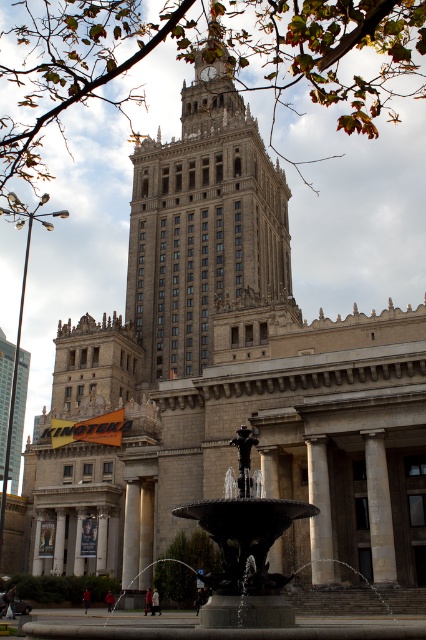
You are standing in front of the grand building with the fountain. You notice two points marked on the image. Which point, point 1 at position (258, 627) or point 2 at position (319, 493), is closer to you?

Point 1 at position (258, 627) is closer to you than point 2 at position (319, 493).

From the picture: You are standing in front of the building and want to take a photo of both the bronze metallic fountain at center and the slate gray stone column at center. Which object should you focus on first to ensure both are in the frame?

You should focus on the bronze metallic fountain at center first because it is closer to you than the slate gray stone column at center, so by focusing on it, the column will also be in focus if they are within the same depth of field.

You are an architect planning to install a new sculpture in the plaza in front of the building. The sculpture must be smaller than the existing bronze metallic fountain at center but larger than the slate gray stone column at center. Can you use the size relationship between these two objects to determine if your sculpture will fit?

The bronze metallic fountain at center is bigger than the slate gray stone column at center. Therefore, your sculpture must be smaller than the bronze metallic fountain at center but larger than the slate gray stone column at center to fit within the specified size constraints.